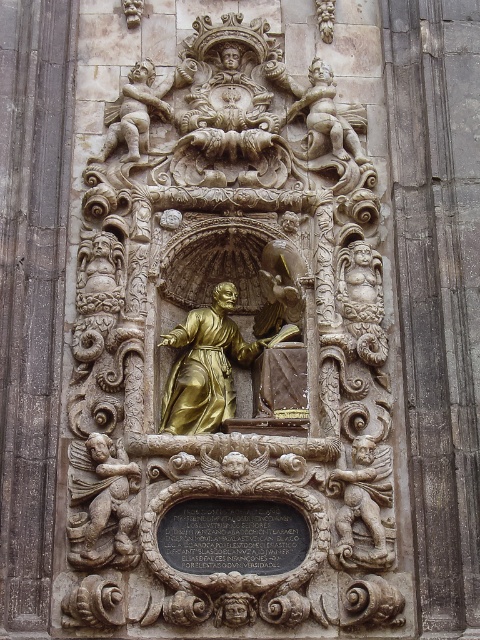
Question: Which point is farther to the camera?

Choices:
 (A) gold polished statue at center
 (B) carved stone cherub at lower left

Answer: (B)

Question: From the image, what is the correct spatial relationship of gold polished statue at center in relation to carved stone cherub at lower left?

Choices:
 (A) below
 (B) above

Answer: (B)

Question: Does gold polished statue at center have a larger size compared to carved stone cherub at lower left?

Choices:
 (A) yes
 (B) no

Answer: (A)

Question: Does gold polished statue at center have a greater width compared to carved stone cherub at lower left?

Choices:
 (A) no
 (B) yes

Answer: (B)

Question: Which point is farther to the camera?

Choices:
 (A) (139, 557)
 (B) (84, 544)

Answer: (A)